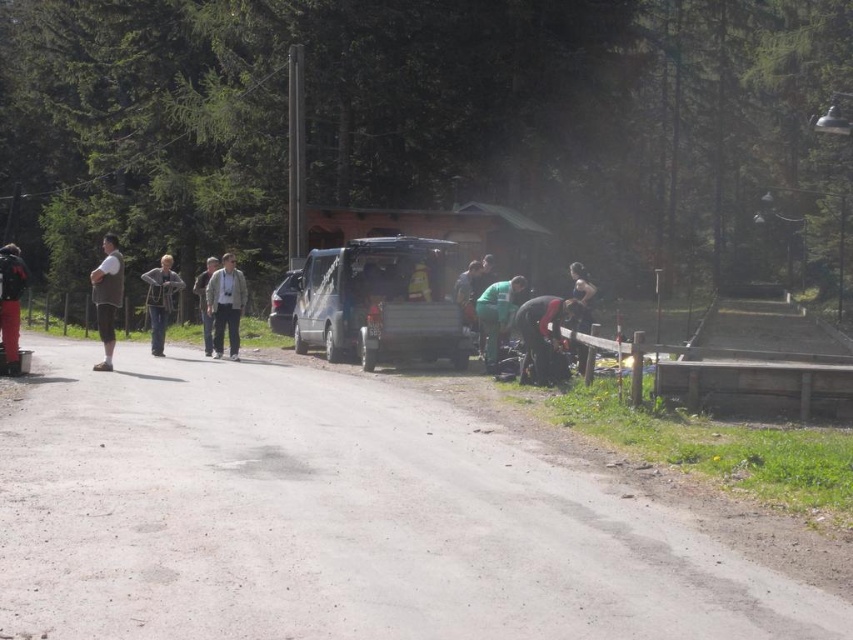
You are a pedestrian standing on the road and want to pick up the light brown leather jacket at center. To reach it, you have to walk past the dark gray fabric jacket at lower right. Is the path clear?

The dark gray fabric jacket at lower right is closer to the viewer than the light brown leather jacket at center, so the path is clear as you can walk towards the light brown leather jacket at center past the dark gray fabric jacket at lower right.